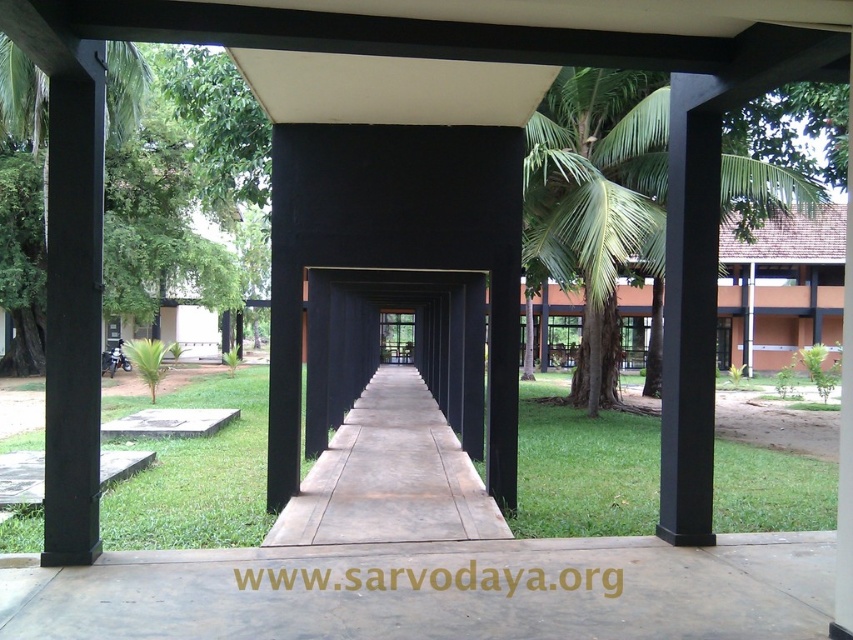
You are standing at the entrance of the corridor formed by the black rectangular columns. You see the green leafy tree at left and the green leafy palm tree at upper right. Which tree is closer to you?

The green leafy tree at left is closer to you because it is positioned over the green leafy palm tree at upper right, indicating it is in front.

You are standing in the corridor formed by the black rectangular columns and want to walk towards the building in the background. Which direction should you go to avoid the black matte pillar at left and reach the green grass at center first?

To avoid the black matte pillar at left and reach the green grass at center first, you should walk towards the right side of the corridor. The green grass at center is closer to you than the black matte pillar at left, so moving right would allow you to step onto the green grass before encountering the pillar.